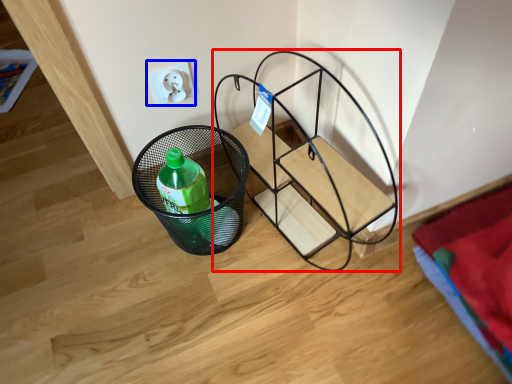
Question: Which of the following is the farthest to the observer, furniture (highlighted by a red box) or electric outlet (highlighted by a blue box)?

Choices:
 (A) furniture
 (B) electric outlet

Answer: (B)